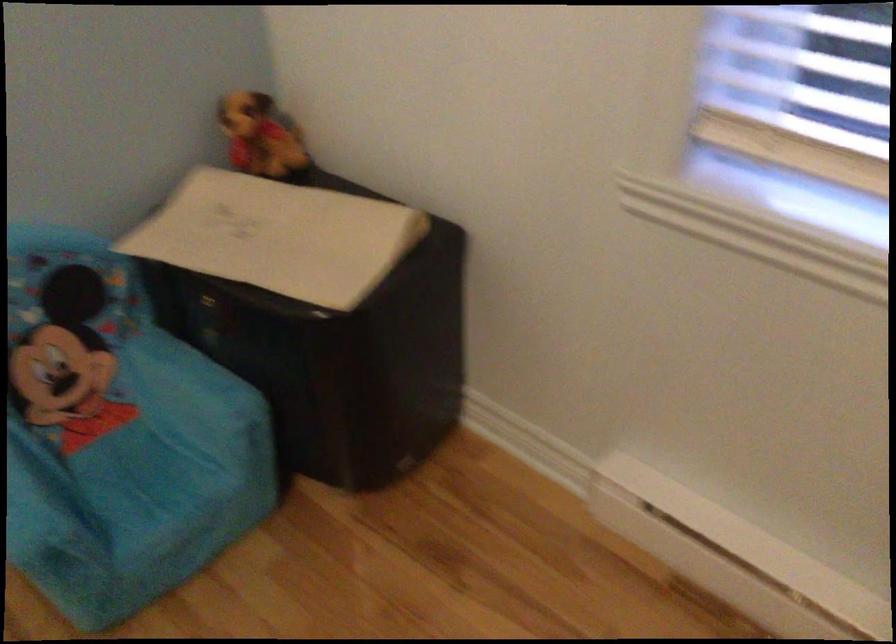
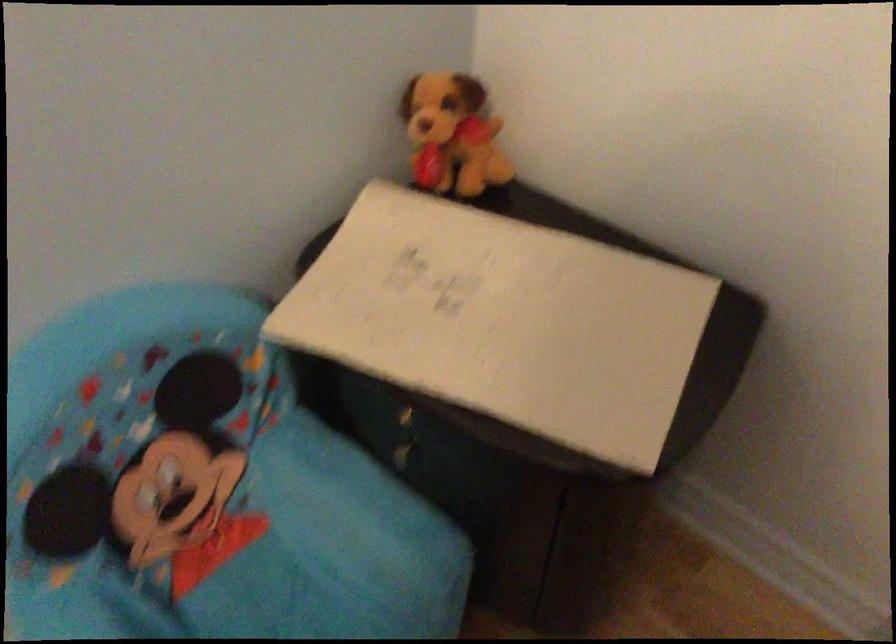
In the second image, find the point that corresponds to point 256,128 in the first image.

(452, 134)